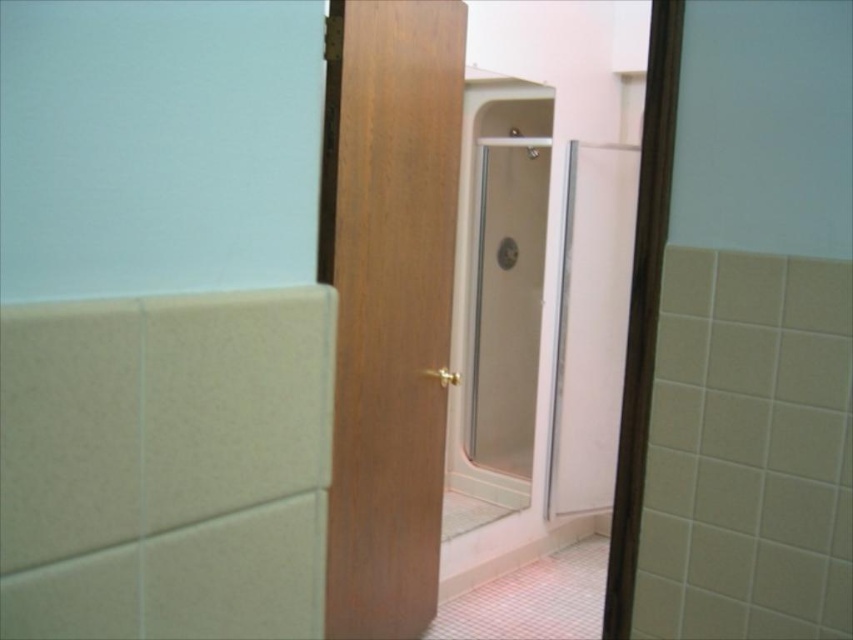
Question: Can you confirm if wooden door at center is wider than clear glass shower door at center?

Choices:
 (A) yes
 (B) no

Answer: (A)

Question: Which object is farther from the camera taking this photo?

Choices:
 (A) clear glass shower door at center
 (B) wooden door at center

Answer: (A)

Question: Does wooden door at center come behind clear glass shower door at center?

Choices:
 (A) no
 (B) yes

Answer: (A)

Question: Can you confirm if wooden door at center is positioned to the left of clear glass shower door at center?

Choices:
 (A) yes
 (B) no

Answer: (A)